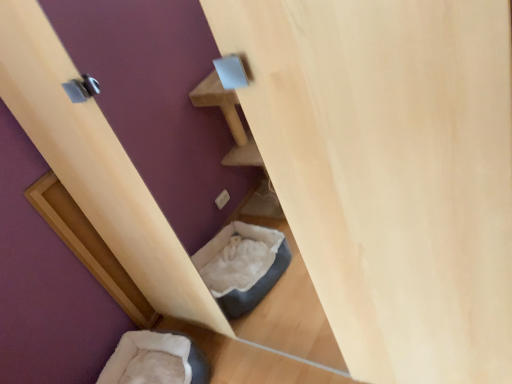
Question: Does point (174, 337) appear closer or farther from the camera than point (125, 301)?

Choices:
 (A) closer
 (B) farther

Answer: (A)

Question: From a real-world perspective, is soft white fur bean bag at lower left positioned above or below wooden door at lower left?

Choices:
 (A) below
 (B) above

Answer: (A)

Question: Is soft white fur bean bag at lower left situated inside wooden door at lower left or outside?

Choices:
 (A) inside
 (B) outside

Answer: (B)

Question: Visually, is wooden door at lower left positioned to the left or to the right of soft white fur bean bag at lower left?

Choices:
 (A) right
 (B) left

Answer: (B)

Question: Is wooden door at lower left taller or shorter than soft white fur bean bag at lower left?

Choices:
 (A) short
 (B) tall

Answer: (B)

Question: In terms of width, does wooden door at lower left look wider or thinner when compared to soft white fur bean bag at lower left?

Choices:
 (A) wide
 (B) thin

Answer: (B)

Question: Considering their positions, is wooden door at lower left located in front of or behind soft white fur bean bag at lower left?

Choices:
 (A) behind
 (B) front

Answer: (A)